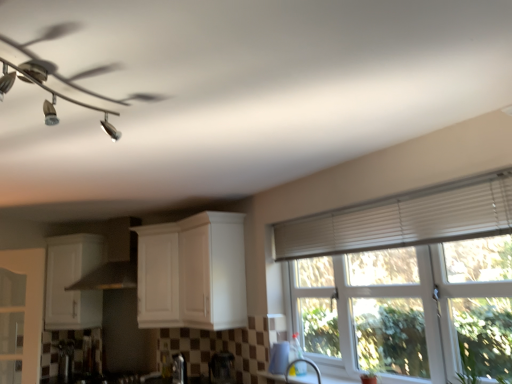
Question: In which direction should I rotate to look at white glossy cabinet at center, the 1th cabinetry when ordered from right to left?

Choices:
 (A) right
 (B) left

Answer: (B)

Question: Is white glossy cup at lower center, acting as the fifth appliance starting from the back, oriented towards white glossy cabinet at center, the 1th cabinetry when ordered from right to left?

Choices:
 (A) yes
 (B) no

Answer: (B)

Question: Can you confirm if white glossy cup at lower center, acting as the fifth appliance starting from the back, is thinner than white glossy cabinet at center, the 1th cabinetry when ordered from right to left?

Choices:
 (A) yes
 (B) no

Answer: (A)

Question: Does white glossy cup at lower center, which is counted as the fifth appliance, starting from the left, have a lesser height compared to white glossy cabinet at center, the second cabinetry positioned from the left?

Choices:
 (A) no
 (B) yes

Answer: (B)

Question: Is white glossy cup at lower center, which is counted as the fifth appliance, starting from the left, at the right side of white glossy cabinet at center, the second cabinetry positioned from the left?

Choices:
 (A) no
 (B) yes

Answer: (B)

Question: From a real-world perspective, is white glossy cup at lower center, acting as the fifth appliance starting from the back, located higher than white glossy cabinet at center, the 1th cabinetry when ordered from right to left?

Choices:
 (A) yes
 (B) no

Answer: (B)

Question: Does white glossy cup at lower center, which is counted as the fifth appliance, starting from the left, have a greater width compared to white glossy cabinet at center, the second cabinetry positioned from the left?

Choices:
 (A) no
 (B) yes

Answer: (A)

Question: From the image's perspective, is metallic stainless steel kettle at lower left, the fourth appliance in the front-to-back sequence, located above white textured window at upper right?

Choices:
 (A) yes
 (B) no

Answer: (B)

Question: Is metallic stainless steel kettle at lower left, the fourth appliance in the front-to-back sequence, thinner than white textured window at upper right?

Choices:
 (A) no
 (B) yes

Answer: (A)

Question: From the image's perspective, is metallic stainless steel kettle at lower left, the fourth appliance in the front-to-back sequence, below white textured window at upper right?

Choices:
 (A) yes
 (B) no

Answer: (A)

Question: Is metallic stainless steel kettle at lower left, which is counted as the 4th appliance, starting from the right, touching white textured window at upper right?

Choices:
 (A) no
 (B) yes

Answer: (A)

Question: Considering the relative sizes of metallic stainless steel kettle at lower left, which ranks as the 2th appliance in back-to-front order, and white textured window at upper right in the image provided, is metallic stainless steel kettle at lower left, which ranks as the 2th appliance in back-to-front order, bigger than white textured window at upper right?

Choices:
 (A) no
 (B) yes

Answer: (A)

Question: Is metallic stainless steel kettle at lower left, which is counted as the 4th appliance, starting from the right, positioned before white textured window at upper right?

Choices:
 (A) yes
 (B) no

Answer: (B)

Question: From a real-world perspective, is satin nickel faucet at lower center physically below white glossy cup at lower center, acting as the fifth appliance starting from the back?

Choices:
 (A) yes
 (B) no

Answer: (A)